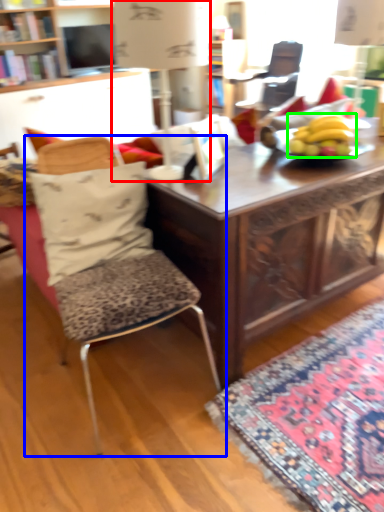
Question: Which object is positioned farthest from table lamp (highlighted by a red box)? Select from chair (highlighted by a blue box) and banana (highlighted by a green box).

Choices:
 (A) chair
 (B) banana

Answer: (A)